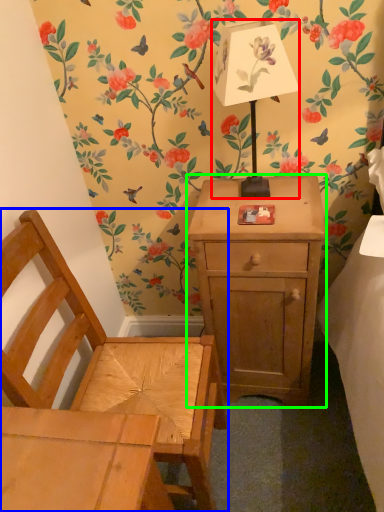
Question: Which is nearer to the table lamp (highlighted by a red box)? chair (highlighted by a blue box) or nightstand (highlighted by a green box).

Choices:
 (A) chair
 (B) nightstand

Answer: (B)